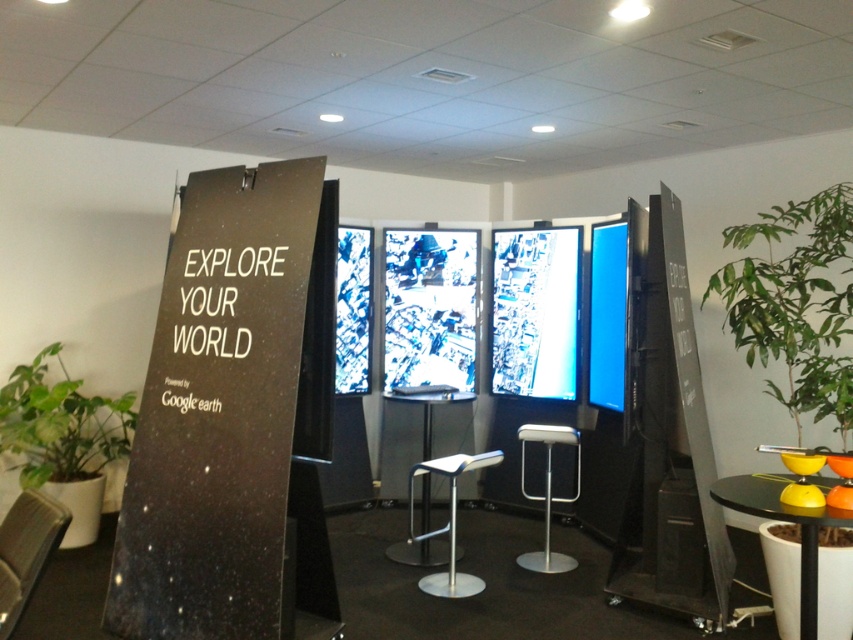
Is green leafy plant at lower left thinner than white plastic bar stool at center?

In fact, green leafy plant at lower left might be wider than white plastic bar stool at center.

Consider the image. Does green leafy plant at lower left have a larger size compared to white plastic bar stool at center?

Yes, green leafy plant at lower left is bigger than white plastic bar stool at center.

Is point (82, 397) positioned after point (549, 460)?

Yes, point (82, 397) is farther from viewer.

Locate an element on the screen. This screenshot has height=640, width=853. green leafy plant at lower left is located at coordinates (59, 426).

Is black glossy signboard at left taller than black glossy table at lower right?

Yes, black glossy signboard at left is taller than black glossy table at lower right.

Does black glossy signboard at left appear under black glossy table at lower right?

No, black glossy signboard at left is not below black glossy table at lower right.

Between point (216, 211) and point (805, 600), which one is positioned in front?

Point (805, 600)

Find the location of a particular element. The height and width of the screenshot is (640, 853). black glossy signboard at left is located at coordinates (235, 419).

Can you confirm if matte gray chair at lower left is taller than silver metallic bar stool at center?

No.

Does matte gray chair at lower left have a greater width compared to silver metallic bar stool at center?

No.

I want to click on matte gray chair at lower left, so click(26, 552).